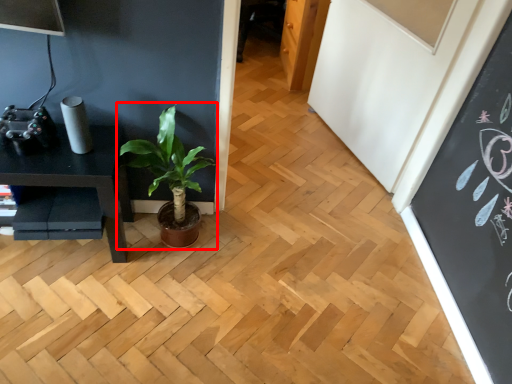
Question: Observing the image, what is the correct spatial positioning of houseplant (annotated by the red box) in reference to table?

Choices:
 (A) right
 (B) left

Answer: (A)